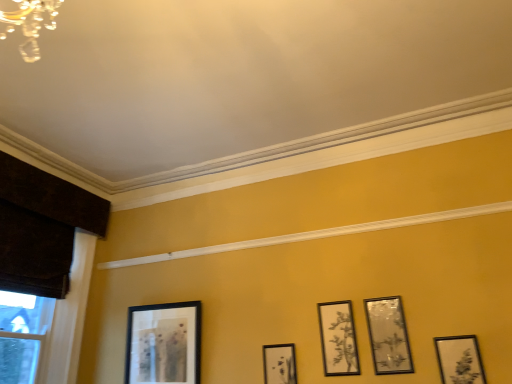
Question: Considering the relative sizes of matte black picture frame at center, marked as the fourth picture frame in a right-to-left arrangement, and matte black picture frame at center, acting as the 3th picture frame starting from the right, in the image provided, is matte black picture frame at center, marked as the fourth picture frame in a right-to-left arrangement, bigger than matte black picture frame at center, acting as the 3th picture frame starting from the right,?

Choices:
 (A) yes
 (B) no

Answer: (A)

Question: Is matte black picture frame at center, marked as the fourth picture frame in a right-to-left arrangement, positioned with its back to matte black picture frame at center, acting as the 3th picture frame starting from the right?

Choices:
 (A) no
 (B) yes

Answer: (A)

Question: From the image's perspective, does matte black picture frame at center, which appears as the second picture frame when viewed from the left, appear higher than matte black picture frame at center, which is counted as the 3th picture frame, starting from the left?

Choices:
 (A) no
 (B) yes

Answer: (A)

Question: Is matte black picture frame at center, which appears as the second picture frame when viewed from the left, placed right next to matte black picture frame at center, which is counted as the 3th picture frame, starting from the left?

Choices:
 (A) yes
 (B) no

Answer: (B)

Question: Could you tell me if matte black picture frame at center, which appears as the second picture frame when viewed from the left, is turned towards matte black picture frame at center, acting as the 3th picture frame starting from the right?

Choices:
 (A) no
 (B) yes

Answer: (A)

Question: Based on their sizes in the image, would you say matte black picture frame at lower right, acting as the 1th picture frame starting from the right, is bigger or smaller than matte silver picture frame at upper right, positioned as the 2th picture frame in right-to-left order?

Choices:
 (A) big
 (B) small

Answer: (B)

Question: Based on their positions, is matte black picture frame at lower right, acting as the 1th picture frame starting from the right, located to the left or right of matte silver picture frame at upper right, the 4th picture frame viewed from the left?

Choices:
 (A) left
 (B) right

Answer: (B)

Question: Is matte black picture frame at lower right, acting as the 1th picture frame starting from the right, spatially inside matte silver picture frame at upper right, positioned as the 2th picture frame in right-to-left order, or outside of it?

Choices:
 (A) inside
 (B) outside

Answer: (B)

Question: Considering the positions of point (468, 360) and point (395, 296), is point (468, 360) closer or farther from the camera than point (395, 296)?

Choices:
 (A) farther
 (B) closer

Answer: (B)

Question: Looking at the image, does dark brown wood at left seem bigger or smaller compared to black matte picture frame at lower left, marked as the 5th picture frame in a right-to-left arrangement?

Choices:
 (A) big
 (B) small

Answer: (A)

Question: Is dark brown wood at left in front of or behind black matte picture frame at lower left, the first picture frame in the left-to-right sequence, in the image?

Choices:
 (A) front
 (B) behind

Answer: (A)

Question: Looking at their shapes, would you say dark brown wood at left is wider or thinner than black matte picture frame at lower left, the first picture frame in the left-to-right sequence?

Choices:
 (A) wide
 (B) thin

Answer: (A)

Question: Does point (66, 304) appear closer or farther from the camera than point (159, 317)?

Choices:
 (A) farther
 (B) closer

Answer: (A)

Question: Looking at the image, does matte black picture frame at center, acting as the 3th picture frame starting from the right, seem bigger or smaller compared to matte black picture frame at lower right, acting as the 1th picture frame starting from the right?

Choices:
 (A) big
 (B) small

Answer: (A)

Question: In the image, is matte black picture frame at center, acting as the 3th picture frame starting from the right, positioned in front of or behind matte black picture frame at lower right, acting as the 1th picture frame starting from the right?

Choices:
 (A) behind
 (B) front

Answer: (A)